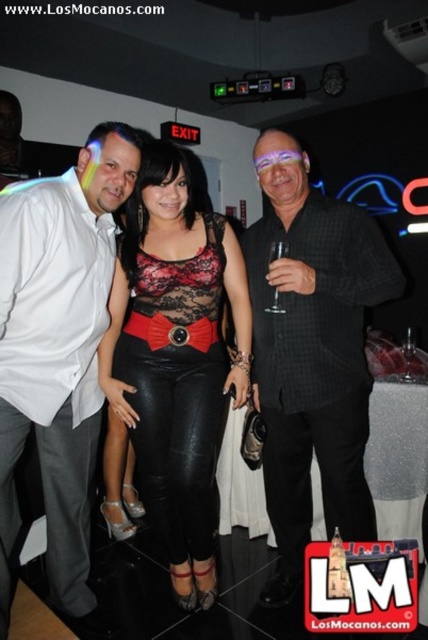
Who is more forward, (12, 276) or (133, 211)?

Point (12, 276) is more forward.

You are a GUI agent. You are given a task and a screenshot of the screen. Output one action in this format:
    pyautogui.click(x=<x>, y=<y>)
    Task: Click on the white shirt at left
    
    Given the screenshot: What is the action you would take?
    pyautogui.click(x=58, y=348)

This screenshot has width=428, height=640. Identify the location of white shirt at left. coord(58,348).

Does black checkered shirt at center have a larger size compared to black leather pants at center?

Correct, black checkered shirt at center is larger in size than black leather pants at center.

Is black checkered shirt at center above black leather pants at center?

Indeed, black checkered shirt at center is positioned over black leather pants at center.

From the picture: Who is more distant from viewer, (323, 416) or (180, 589)?

Positioned behind is point (180, 589).

This screenshot has height=640, width=428. In order to click on black checkered shirt at center in this screenshot , I will do `click(312, 352)`.

Who is more distant from viewer, [326,522] or [20,387]?

Point [326,522]

From the picture: Who is more forward, (x=293, y=518) or (x=101, y=243)?

Point (x=101, y=243) is in front.

At what (x,y) coordinates should I click in order to perform the action: click on black checkered shirt at center. Please return your answer as a coordinate pair (x, y). This screenshot has width=428, height=640. Looking at the image, I should click on (312, 352).